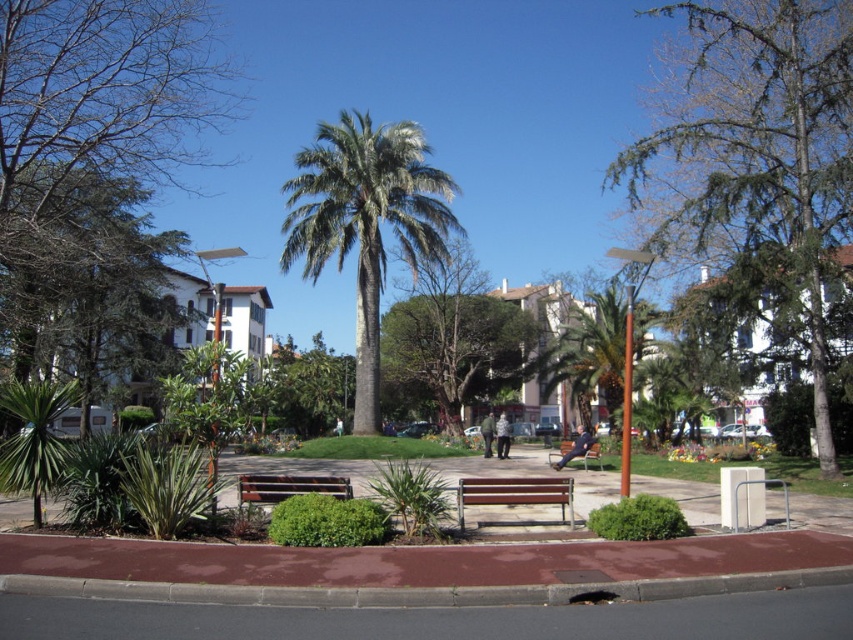
You are a park visitor standing at the entrance of the park and looking towards the center. You see both the green textured tree at center and the green leafy palm tree at center. Which tree appears closer to you?

The green textured tree at center appears closer because it is in front of the green leafy palm tree at center from your viewpoint.

You are standing at the point labeled as point (756, 161) in the image. Looking around, you see a green textured tree at center. Which direction should you walk to reach the nearest paved pathway bordered by a reddish brown curb?

The point (756, 161) is located on the green textured tree at center. To reach the nearest paved pathway bordered by a reddish brown curb, you should walk towards the foreground since the pathway is in the foreground area of the image.